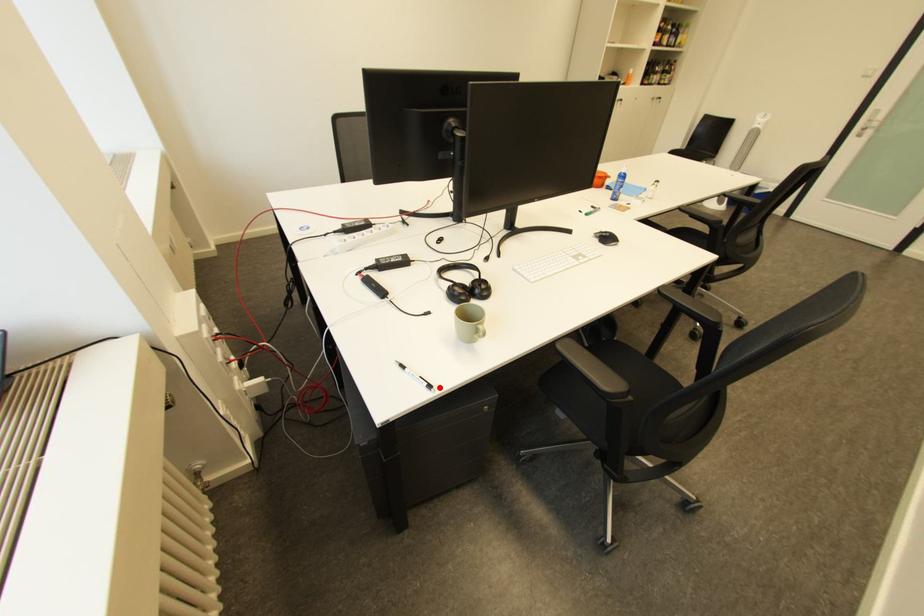
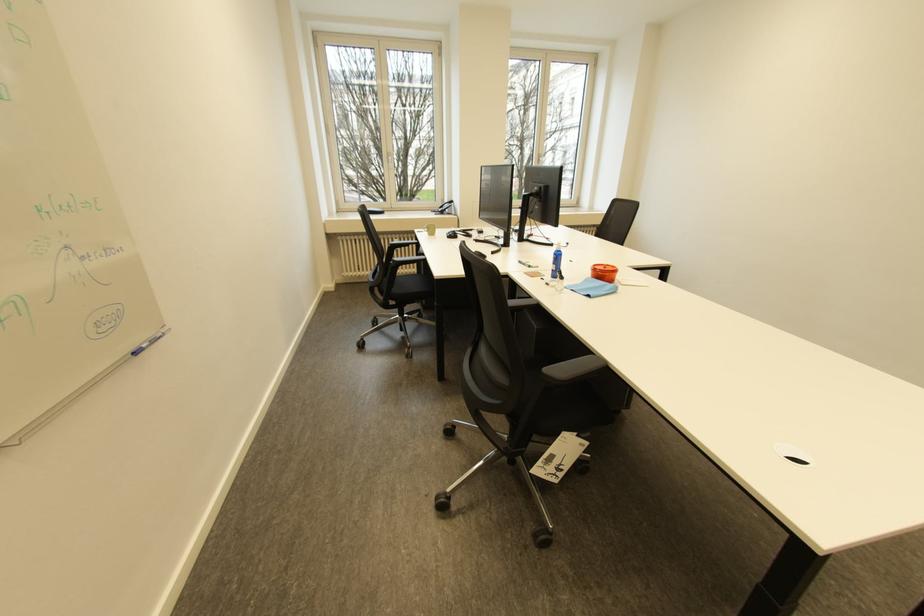
Find the pixel in the second image that matches the highlighted location in the first image.

(428, 233)